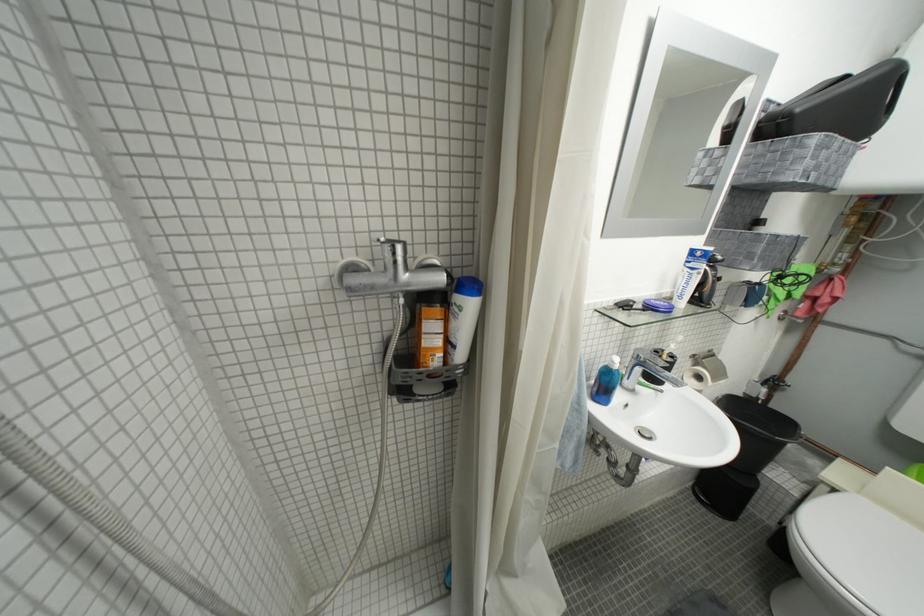
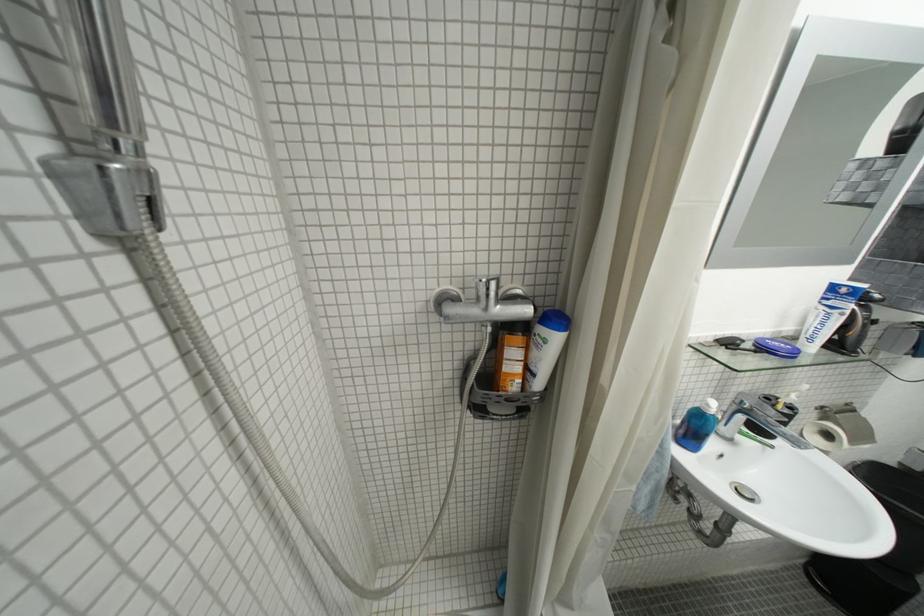
The point at (698, 264) is marked in the first image. Where is the corresponding point in the second image?

(833, 301)